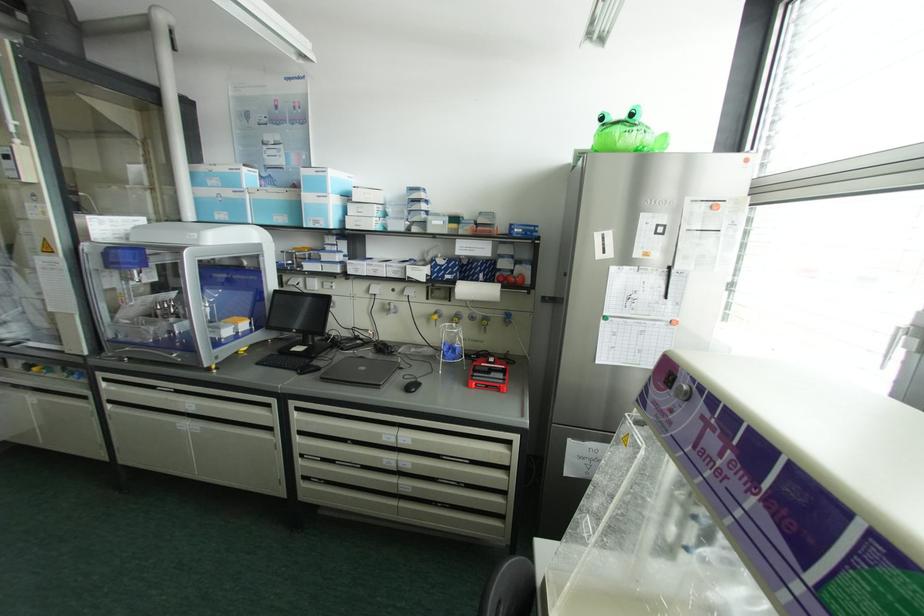
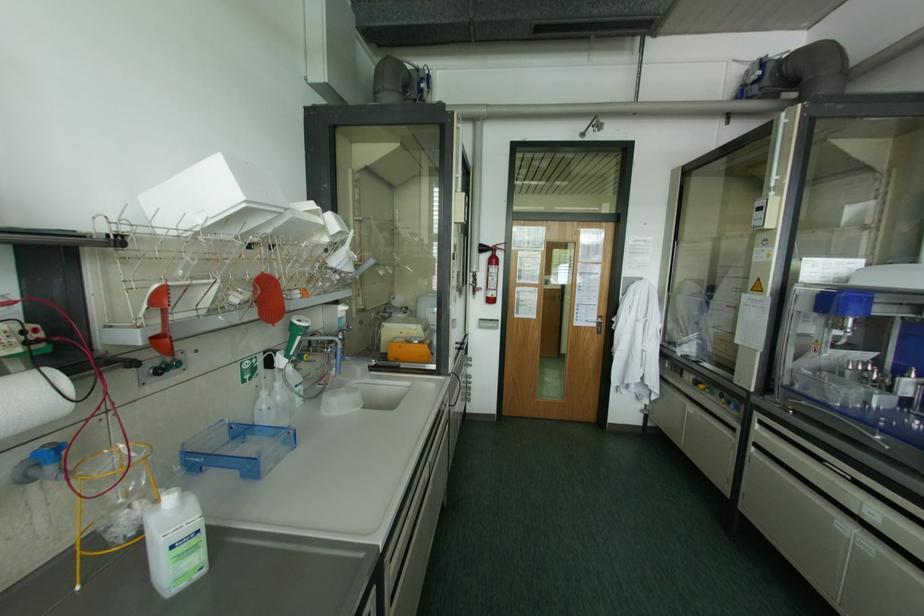
Question: The images are taken continuously from a first-person perspective. In which direction is your viewpoint rotating?

Choices:
 (A) Left
 (B) Right
 (C) Up
 (D) Down

Answer: (A)